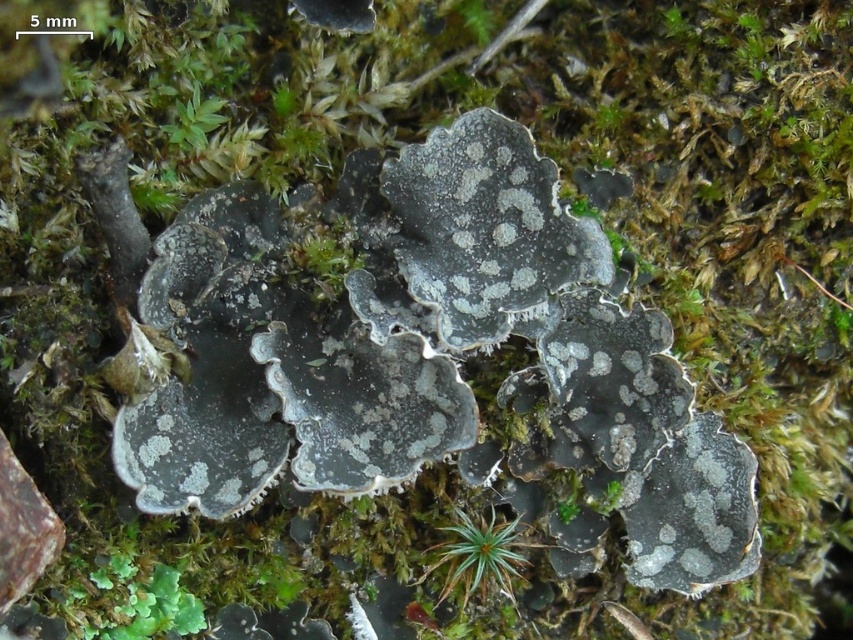
In the scene shown: Who is shorter, green leafy plant at lower left or green fuzzy moss at center?

green fuzzy moss at center

Which is in front, point (184, 609) or point (448, 532)?

Point (184, 609) is in front.

Image resolution: width=853 pixels, height=640 pixels. In order to click on green leafy plant at lower left in this screenshot , I will do `click(123, 596)`.